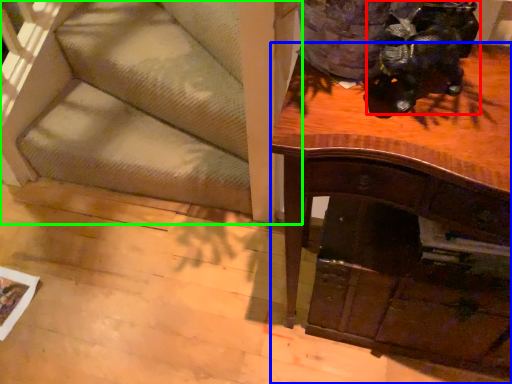
Question: Considering the real-world distances, which object is closest to animal (highlighted by a red box)? desk (highlighted by a blue box) or furniture (highlighted by a green box).

Choices:
 (A) desk
 (B) furniture

Answer: (A)